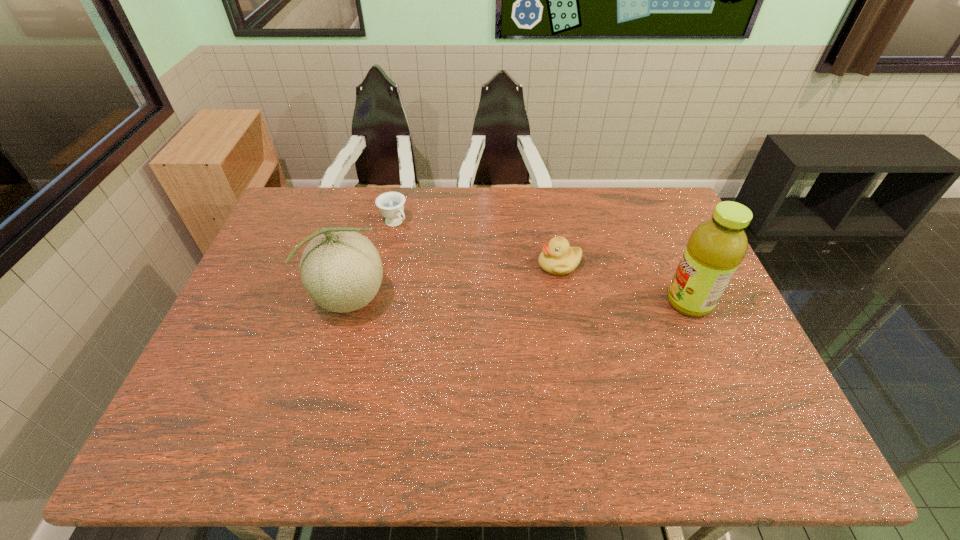
Where is `free space on the desktop that is between the cantaloup and the rightmost object and is positioned on the side of the teacup with the handle`? This screenshot has height=540, width=960. free space on the desktop that is between the cantaloup and the rightmost object and is positioned on the side of the teacup with the handle is located at coordinates (480, 300).

What are the coordinates of `free space on the desktop that is between the cantaloup and the rightmost object and is positioned on the beak of the second shortest object` in the screenshot? It's located at (494, 300).